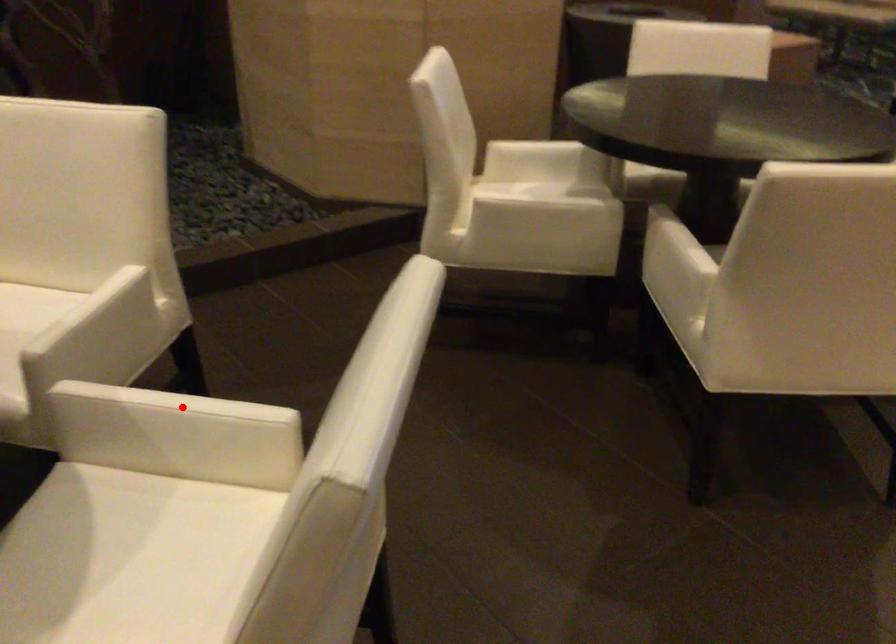
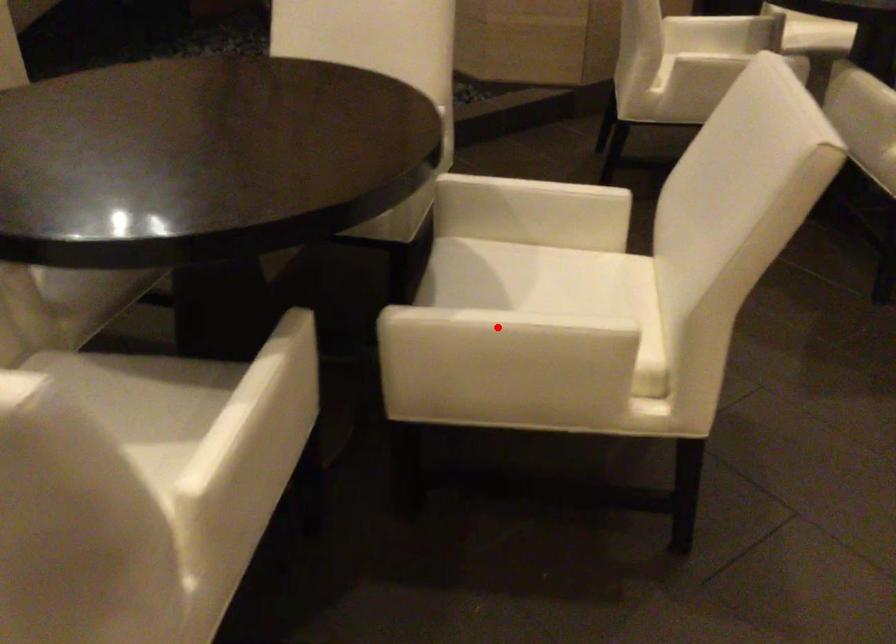
I am providing you with two images of the same scene from different viewpoints. A red point is marked on the first image and another point is marked on the second image. Do the highlighted points in image1 and image2 indicate the same real-world spot?

No